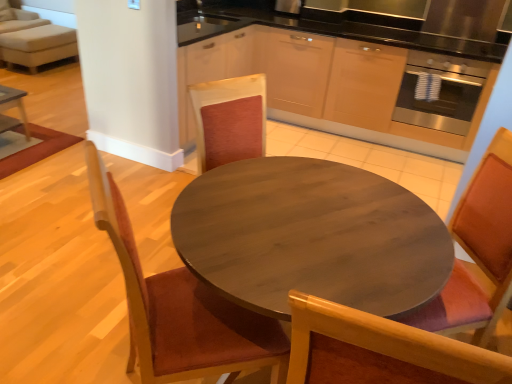
Question: Is wooden chair at center, the 1th chair viewed from the right, next to wooden chair at left, the 1th chair viewed from the left?

Choices:
 (A) yes
 (B) no

Answer: (B)

Question: Is wooden chair at center, the 2th chair from the left, bigger than wooden chair at left, placed as the second chair when sorted from right to left?

Choices:
 (A) yes
 (B) no

Answer: (B)

Question: Considering the relative sizes of wooden chair at center, the 2th chair from the left, and wooden chair at left, the 1th chair viewed from the left, in the image provided, is wooden chair at center, the 2th chair from the left, taller than wooden chair at left, the 1th chair viewed from the left,?

Choices:
 (A) yes
 (B) no

Answer: (B)

Question: Considering the relative positions of wooden chair at center, the 1th chair viewed from the right, and wooden chair at left, the 1th chair viewed from the left, in the image provided, is wooden chair at center, the 1th chair viewed from the right, to the right of wooden chair at left, the 1th chair viewed from the left, from the viewer's perspective?

Choices:
 (A) yes
 (B) no

Answer: (A)

Question: From the image's perspective, is wooden chair at center, the 2th chair from the left, located beneath wooden chair at left, the 1th chair viewed from the left?

Choices:
 (A) yes
 (B) no

Answer: (B)

Question: From the image's perspective, is stainless steel oven at right above or below wooden table at center?

Choices:
 (A) above
 (B) below

Answer: (A)

Question: From a real-world perspective, is stainless steel oven at right above or below wooden table at center?

Choices:
 (A) above
 (B) below

Answer: (A)

Question: Considering the positions of point (419, 69) and point (203, 254), is point (419, 69) closer or farther from the camera than point (203, 254)?

Choices:
 (A) closer
 (B) farther

Answer: (B)

Question: Based on their positions, is stainless steel oven at right located to the left or right of wooden table at center?

Choices:
 (A) right
 (B) left

Answer: (A)

Question: Looking at their shapes, would you say wooden chair at center, the 1th chair viewed from the right, is wider or thinner than light beige fabric couch at upper left?

Choices:
 (A) wide
 (B) thin

Answer: (B)

Question: Is wooden chair at center, the 2th chair from the left, taller or shorter than light beige fabric couch at upper left?

Choices:
 (A) short
 (B) tall

Answer: (A)

Question: From the image's perspective, relative to light beige fabric couch at upper left, is wooden chair at center, the 1th chair viewed from the right, above or below?

Choices:
 (A) below
 (B) above

Answer: (A)

Question: Considering the relative positions of wooden chair at center, the 1th chair viewed from the right, and light beige fabric couch at upper left in the image provided, is wooden chair at center, the 1th chair viewed from the right, to the left or to the right of light beige fabric couch at upper left?

Choices:
 (A) right
 (B) left

Answer: (A)

Question: Is point (377, 258) closer or farther from the camera than point (214, 317)?

Choices:
 (A) farther
 (B) closer

Answer: (B)

Question: Considering the positions of wooden table at center and wooden chair at left, placed as the second chair when sorted from right to left, in the image, is wooden table at center wider or thinner than wooden chair at left, placed as the second chair when sorted from right to left,?

Choices:
 (A) wide
 (B) thin

Answer: (A)